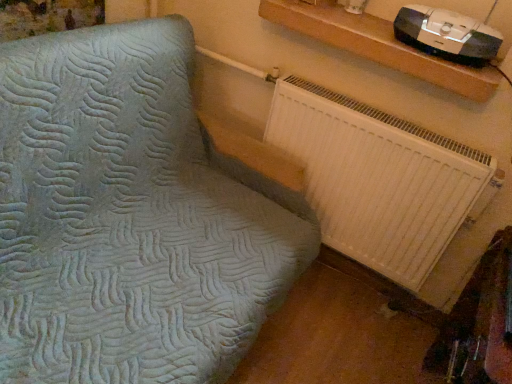
The height and width of the screenshot is (384, 512). What are the coordinates of `vacant region above wooden shelf at upper right (from a real-world perspective)` in the screenshot? It's located at (373, 26).